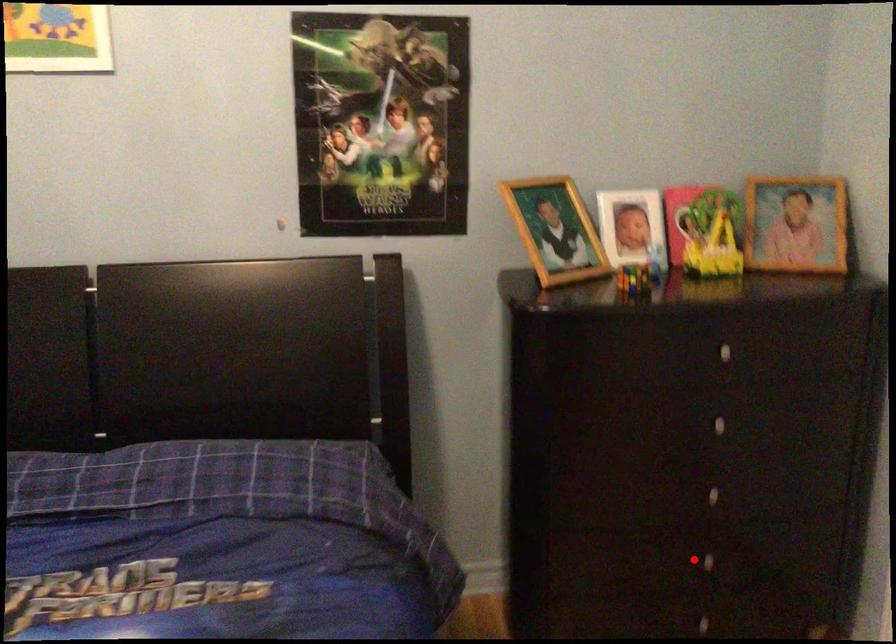
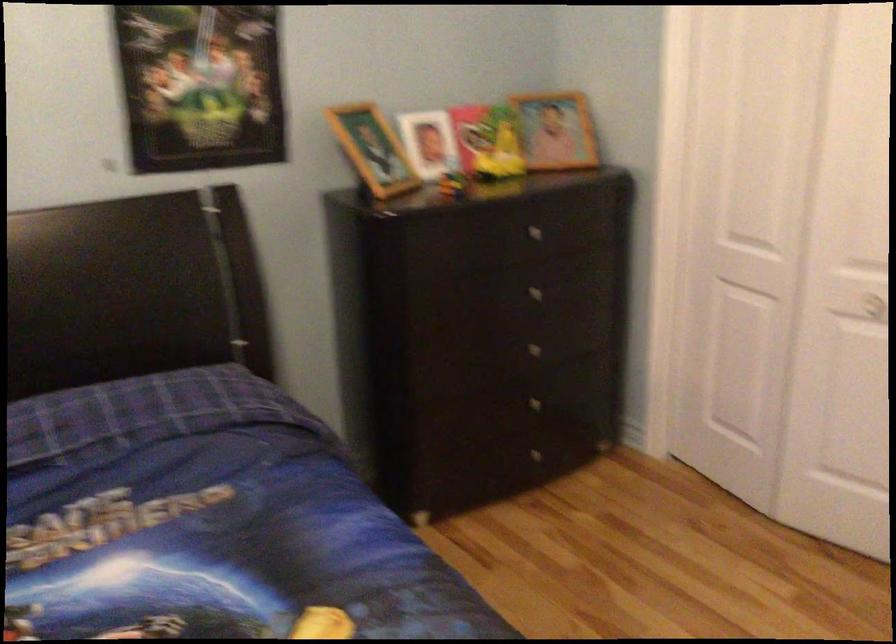
The point at the highlighted location is marked in the first image. Where is the corresponding point in the second image?

(528, 406)